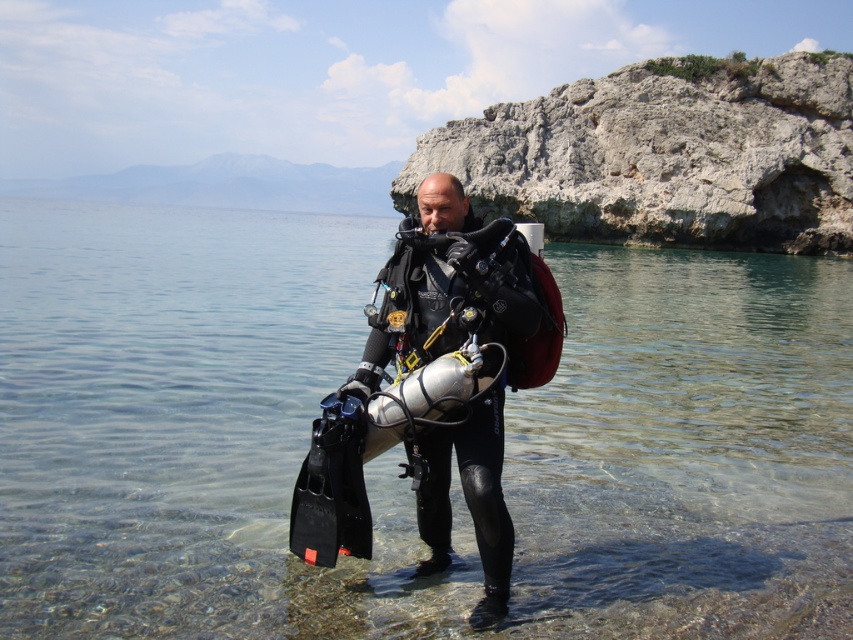
Question: Does clear water at center have a greater width compared to black matte wetsuit at center?

Choices:
 (A) no
 (B) yes

Answer: (B)

Question: Among these objects, which one is nearest to the camera?

Choices:
 (A) clear water at center
 (B) black matte wetsuit at center

Answer: (B)

Question: Does clear water at center come in front of black matte wetsuit at center?

Choices:
 (A) no
 (B) yes

Answer: (A)

Question: Is clear water at center further to camera compared to black matte wetsuit at center?

Choices:
 (A) no
 (B) yes

Answer: (B)

Question: Which of the following is the closest to the observer?

Choices:
 (A) black matte wetsuit at center
 (B) clear water at center

Answer: (A)